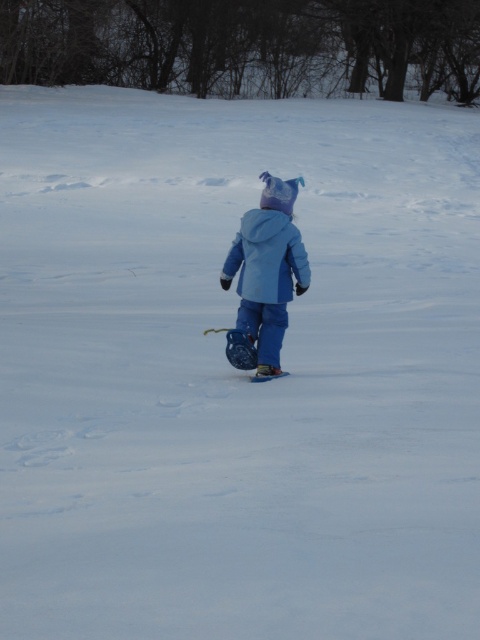
The child is wearing two blue items. Which one is taller, the matte blue snowsuit at center or the matte blue jacket at center?

The matte blue snowsuit at center is taller than the matte blue jacket at center.

Based on the photo, you are a photographer trying to capture the matte blue snowsuit at center in your shot. Based on the coordinates provided, where should you position your camera to ensure the snowsuit is centered in the frame?

The matte blue snowsuit at center is located at coordinates point (x=265, y=275), so positioning the camera to center the frame at those coordinates will ensure the snowsuit is centered.

You are a photographer trying to capture the child in the snowy landscape. You notice the matte blue snowsuit at center and the matte blue jacket at center. How far apart are these two items in inches?

The distance between the matte blue snowsuit at center and the matte blue jacket at center is 2.57 inches.